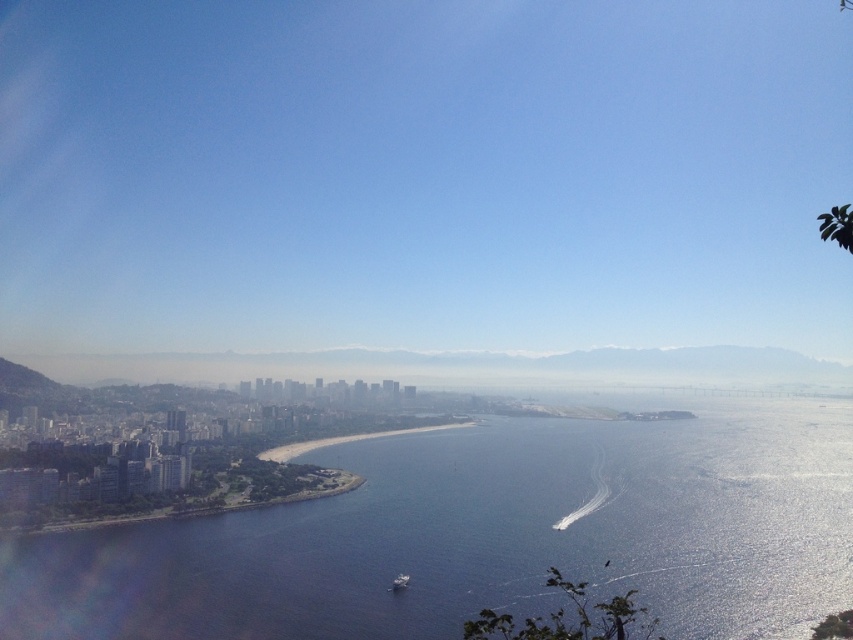
You are standing on a pier and see the blue liquid water at lower left and the metallic gray boat at lower center. Which object is closer to your left side?

The metallic gray boat at lower center is closer to your left side because the blue liquid water at lower left is positioned on the right side of it.

Looking at this image, you are a tourist standing at the golden sand beach at center and want to take a photo of the metallic gray boat at lower center. Which object should you position closer to the camera to ensure the boat appears larger in the photo?

To make the metallic gray boat at lower center appear larger in the photo, you should position yourself closer to the metallic gray boat at lower center. Since the golden sand beach at center is taller than the metallic gray boat at lower center, moving closer to the boat will reduce the distance and make it appear bigger in the frame.